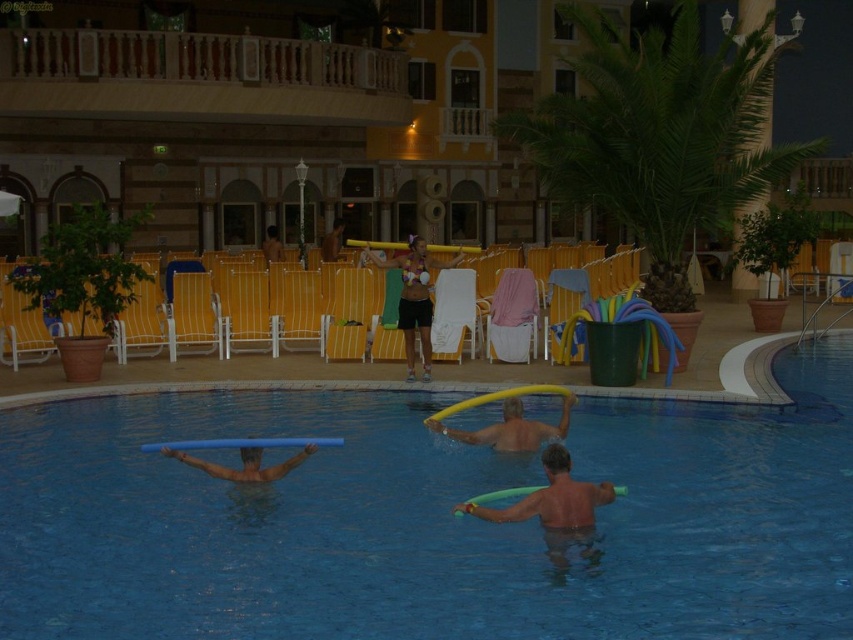
Consider the image. Between blue rubber ring at center and yellow foam at upper center, which one has less height?

Standing shorter between the two is yellow foam at upper center.

Is blue rubber ring at center thinner than yellow foam at upper center?

In fact, blue rubber ring at center might be wider than yellow foam at upper center.

Who is more forward, (x=97, y=627) or (x=561, y=397)?

Point (x=97, y=627) is in front.

Identify the location of blue rubber ring at center. (431, 522).

Between matte bikini top at center and blue rubber tube at center, which one appears on the right side from the viewer's perspective?

Positioned to the right is matte bikini top at center.

Which is in front, point (422, 248) or point (293, 467)?

Point (293, 467) is in front.

You are a GUI agent. You are given a task and a screenshot of the screen. Output one action in this format:
    pyautogui.click(x=<x>, y=<y>)
    Task: Click on the matte bikini top at center
    
    Given the screenshot: What is the action you would take?
    pyautogui.click(x=415, y=300)

The width and height of the screenshot is (853, 640). In order to click on matte bikini top at center in this screenshot , I will do `click(415, 300)`.

How far apart are blue rubber ring at center and matte black bikini at center?

They are 18.56 meters apart.

Can you confirm if blue rubber ring at center is positioned above matte black bikini at center?

No.

Is point (619, 422) closer to camera compared to point (271, 230)?

That is True.

Find the location of a particular element. The height and width of the screenshot is (640, 853). blue rubber ring at center is located at coordinates (431, 522).